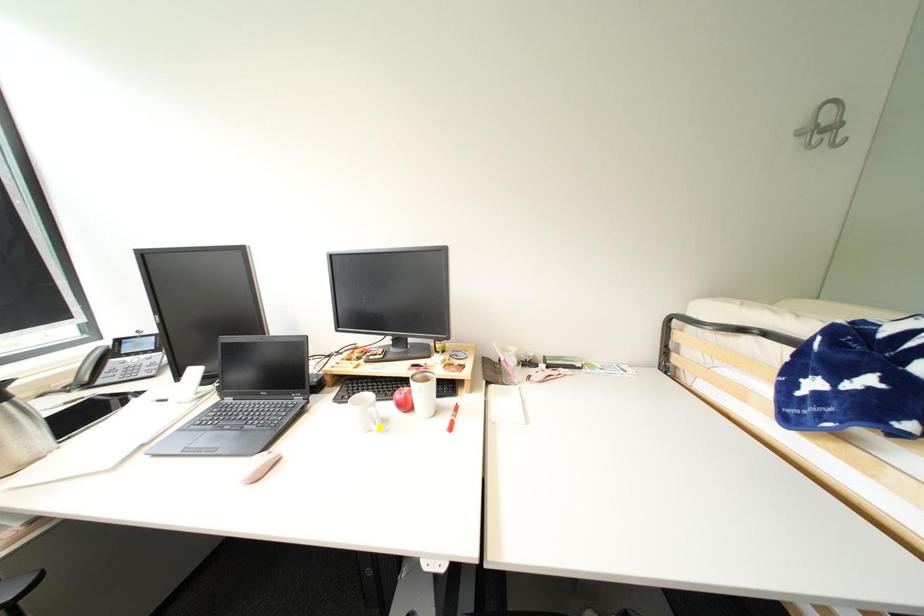
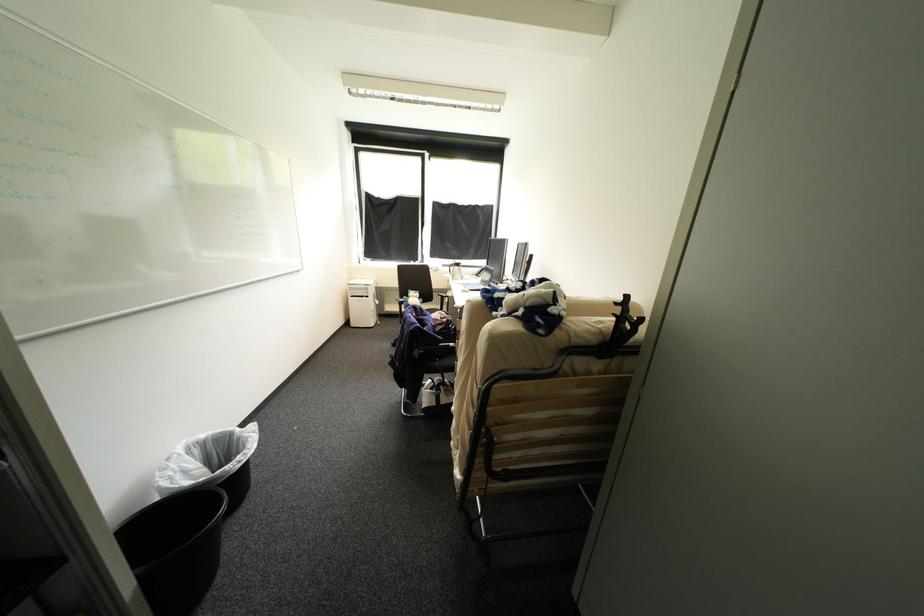
I am providing you with two images of the same scene from different viewpoints. Three points are marked in image1. Which point corresponds to a part or object that is occluded in image2?In image1, three points are marked. Which of them correspond to a part or object that is occluded in image2?Among the three points shown in image1, which one corresponds to a part or object that is no longer visible due to occlusion in image2?

Invisible in image2: blue point, green point, yellow point.